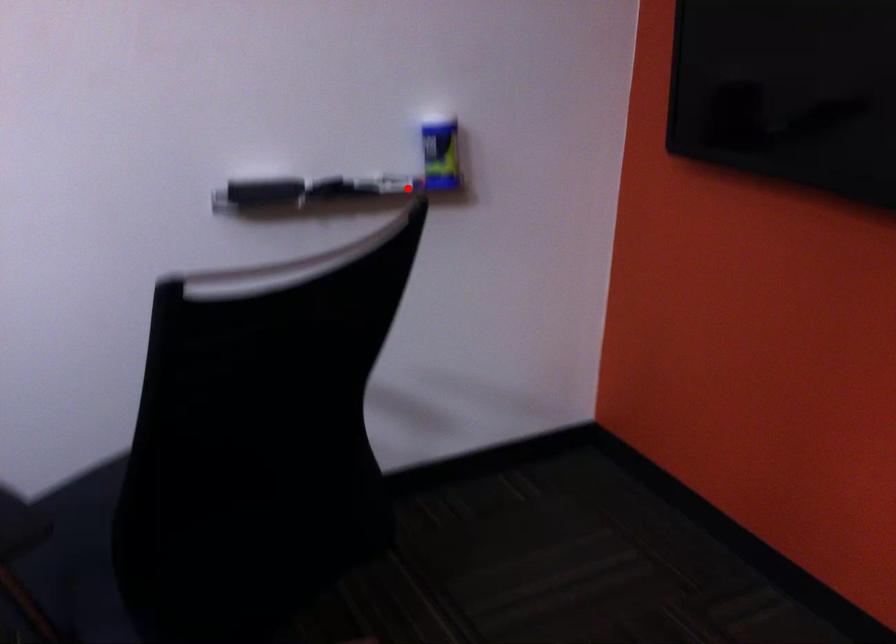
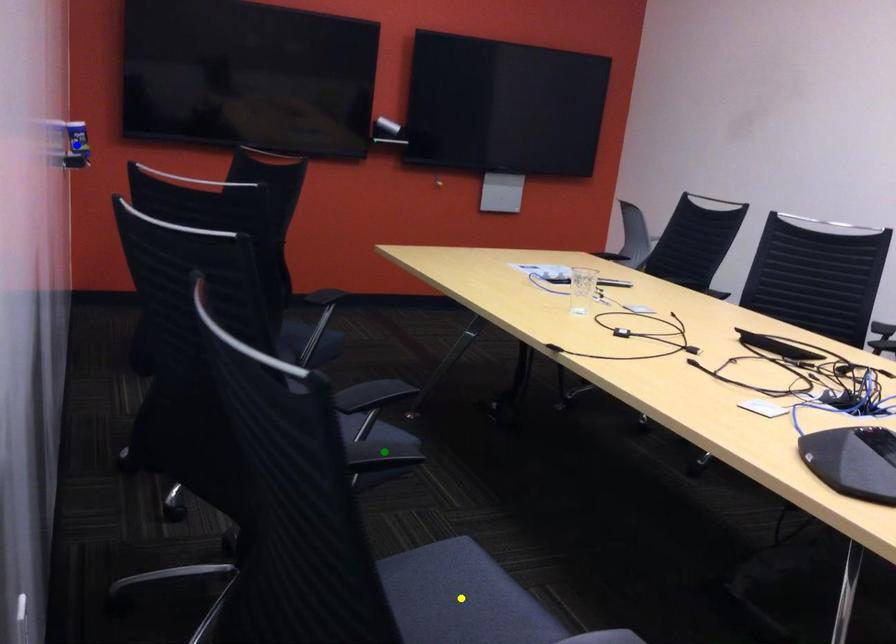
Question: I am providing you with two images of the same scene from different viewpoints. A red point is marked on the first image. You are given multiple points on the second image. Can you choose the point in image 2 that corresponds to the point in image 1?

Choices:
 (A) blue point
 (B) yellow point
 (C) green point

Answer: (A)